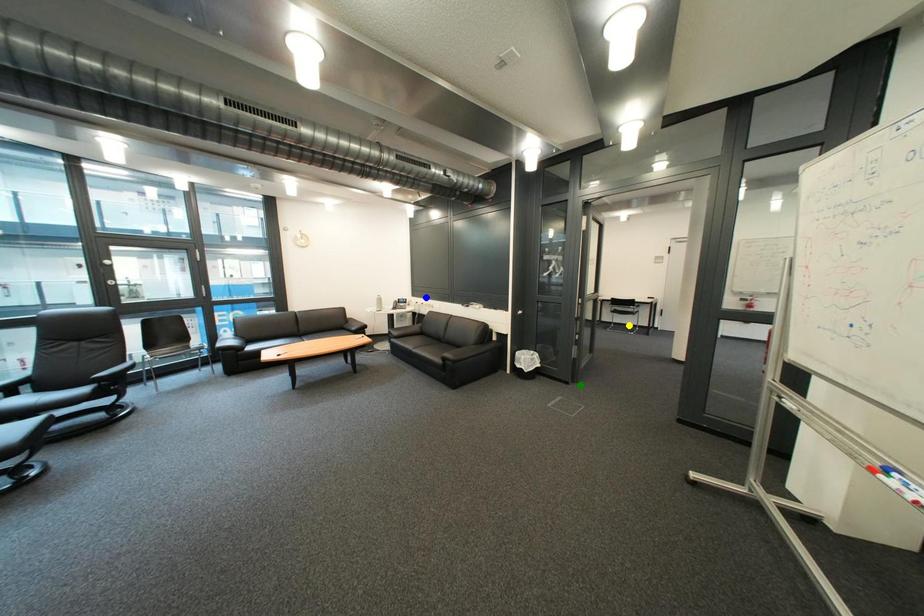
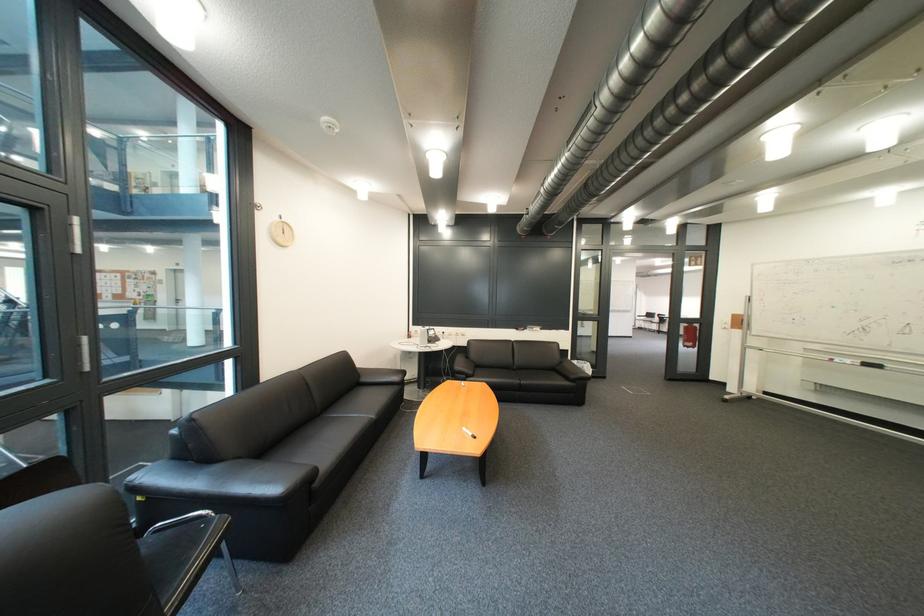
I am providing you with two images of the same scene from different viewpoints. Three points are marked in image1. Which point corresponds to a part or object that is occluded in image2?In image1, three points are marked. Which of them correspond to a part or object that is occluded in image2?Among the three points shown in image1, which one corresponds to a part or object that is no longer visible due to occlusion in image2?

Invisible in image2: yellow point.